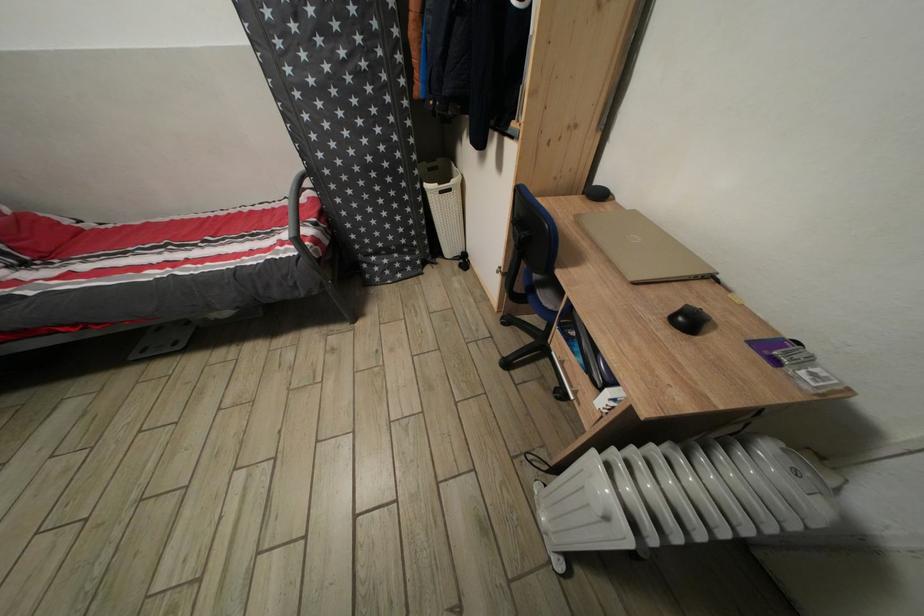
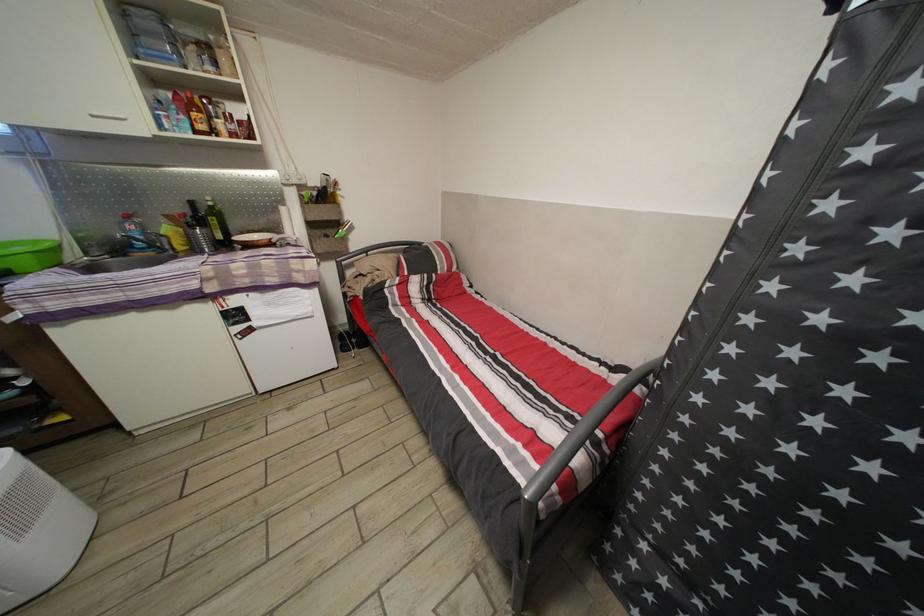
Question: Based on the continuous images, in which direction is the camera rotating? Reply with the corresponding letter.

Choices:
 (A) Left
 (B) Right
 (C) Up
 (D) Down

Answer: (A)